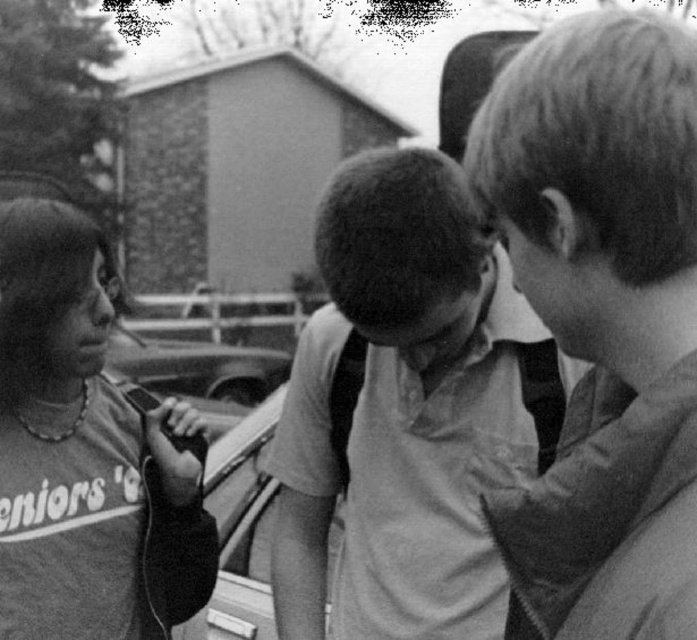
You are standing at the point labeled point (474, 291). You want to walk to the house in the background. Is the house behind you or in front of you?

The house is in the background, so it is in front of you.

You are standing in the residential area shown in the photo. You notice two points marked in the image. The first point is at coordinate (x=398, y=257) and the second is at (x=56, y=269). Which point is closer to you?

The point at coordinate (x=398, y=257) is closer to the viewer than the point at (x=56, y=269).

Based on the scene description, where is the smooth brown hair at upper right located in terms of coordinates?

The smooth brown hair at upper right is located at coordinates point (604, 316).